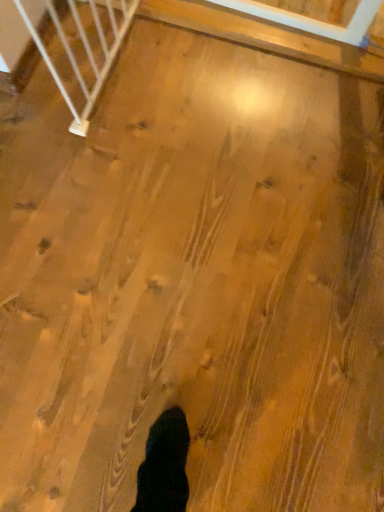
Image resolution: width=384 pixels, height=512 pixels. What do you see at coordinates (85, 50) in the screenshot?
I see `white plastic rail at upper left` at bounding box center [85, 50].

This screenshot has height=512, width=384. Find the location of `white plastic rail at upper left`. white plastic rail at upper left is located at coordinates (85, 50).

This screenshot has width=384, height=512. I want to click on white plastic rail at upper left, so click(x=85, y=50).